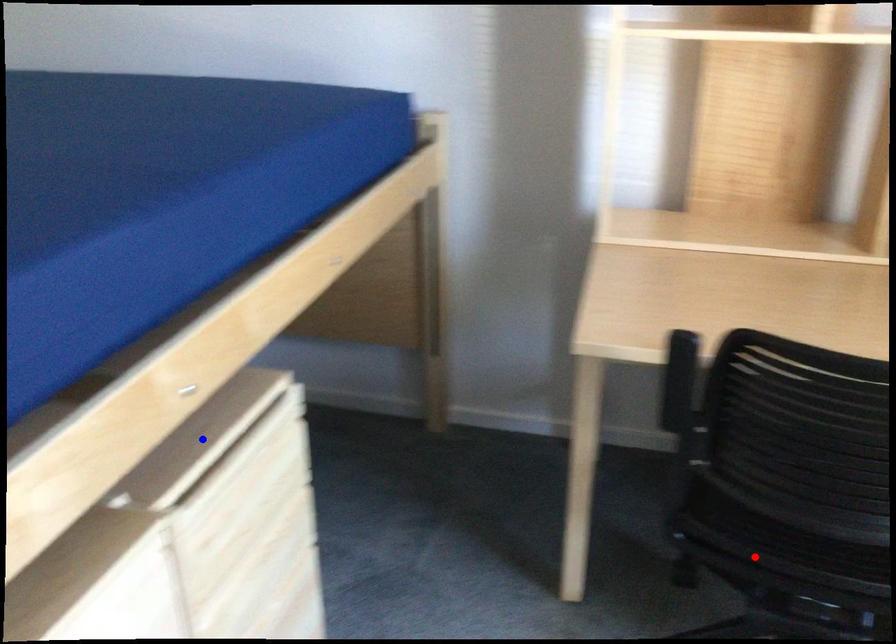
Question: Which of the two points in the image is closer to the camera?

Choices:
 (A) Blue point is closer.
 (B) Red point is closer.

Answer: (A)